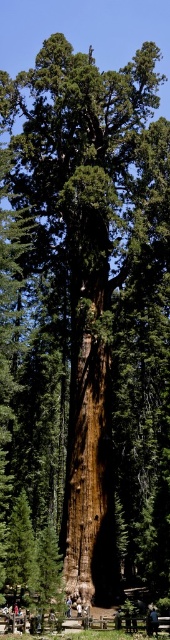
Can you confirm if black leather jacket at center is taller than blue jeans at lower center?

In fact, black leather jacket at center may be shorter than blue jeans at lower center.

Can you confirm if black leather jacket at center is thinner than blue jeans at lower center?

No.

This screenshot has height=640, width=170. What do you see at coordinates (154, 620) in the screenshot?
I see `black leather jacket at center` at bounding box center [154, 620].

Locate an element on the screen. The image size is (170, 640). black leather jacket at center is located at coordinates (154, 620).

Can you confirm if dark brown leather jacket at center is bigger than blue jeans at lower center?

Incorrect, dark brown leather jacket at center is not larger than blue jeans at lower center.

Is dark brown leather jacket at center closer to camera compared to blue jeans at lower center?

Yes.

I want to click on dark brown leather jacket at center, so click(x=117, y=618).

Who is positioned more to the right, black leather jacket at center or dark brown leather jacket at center?

From the viewer's perspective, black leather jacket at center appears more on the right side.

Is black leather jacket at center taller than dark brown leather jacket at center?

No, black leather jacket at center is not taller than dark brown leather jacket at center.

Which is in front, point (153, 616) or point (115, 624)?

Point (153, 616)

You are a GUI agent. You are given a task and a screenshot of the screen. Output one action in this format:
    pyautogui.click(x=<x>, y=<y>)
    Task: Click on the black leather jacket at center
    Image resolution: width=170 pixels, height=640 pixels.
    Given the screenshot: What is the action you would take?
    pyautogui.click(x=154, y=620)